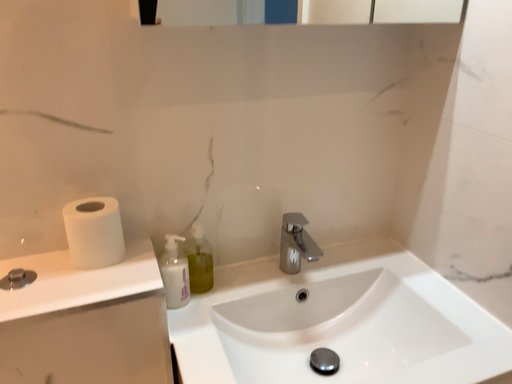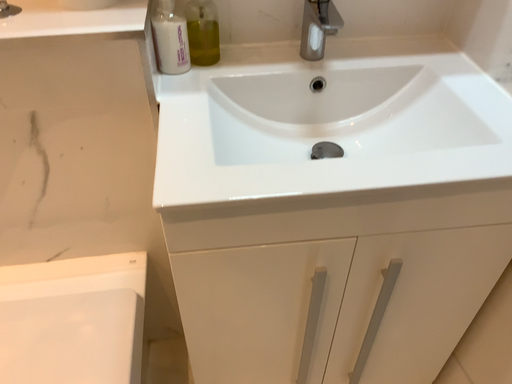
Question: How did the camera likely rotate when shooting the video?

Choices:
 (A) rotated upward
 (B) rotated downward

Answer: (B)